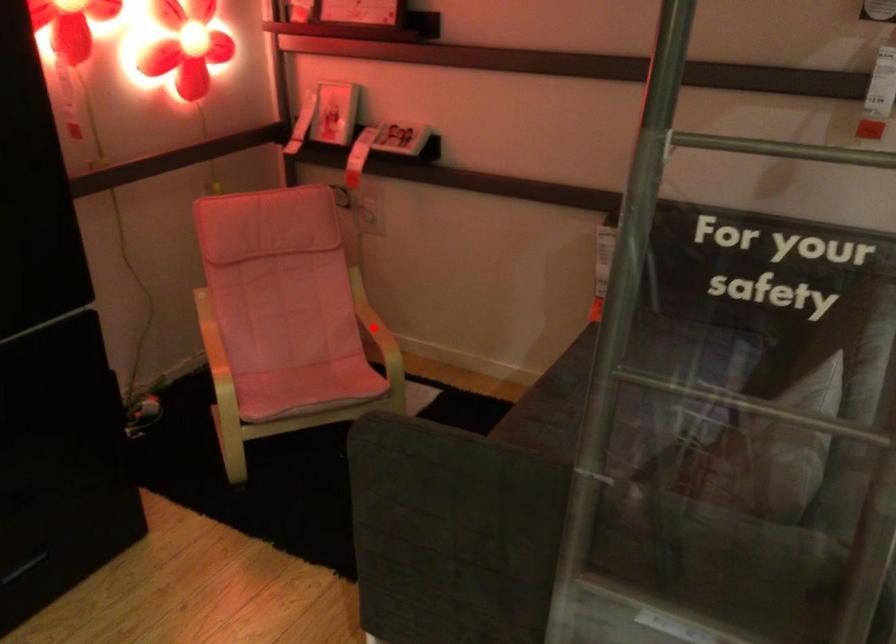
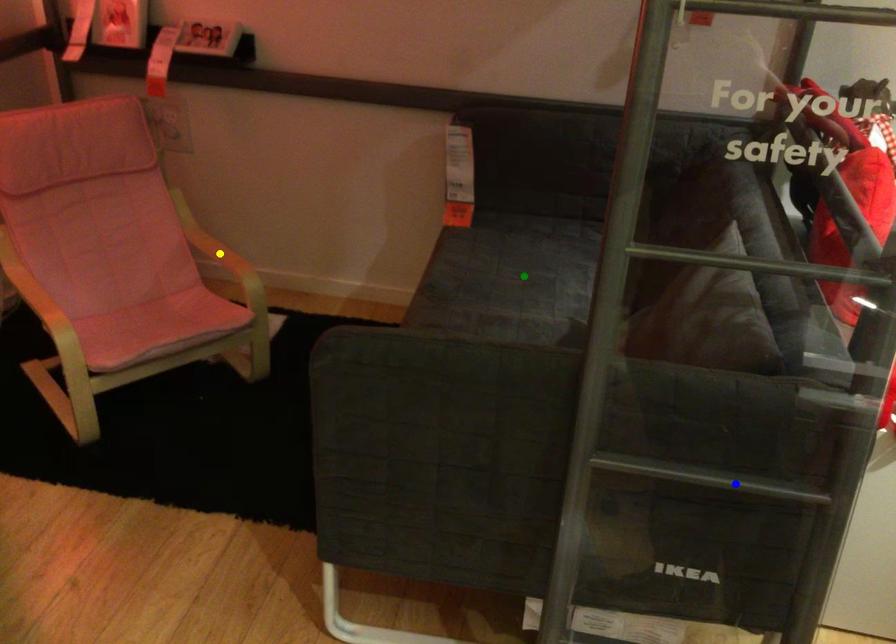
Question: I am providing you with two images of the same scene from different viewpoints. A red point is marked on the first image. You are given multiple points on the second image. Which mark in image 2 goes with the point in image 1?

Choices:
 (A) green point
 (B) yellow point
 (C) blue point

Answer: (B)